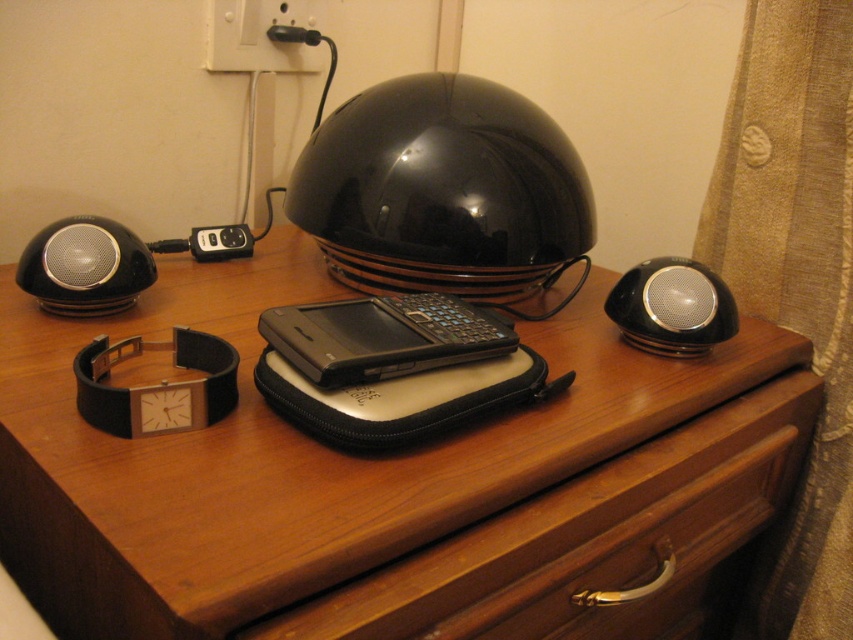
Can you confirm if glossy black helmet at center is shorter than black glossy speaker at left?

No, glossy black helmet at center is not shorter than black glossy speaker at left.

Which is more to the right, glossy black helmet at center or black glossy speaker at left?

glossy black helmet at center is more to the right.

Who is more distant from viewer, (300,189) or (109,291)?

The point (300,189) is behind.

Find the location of a particular element. The width and height of the screenshot is (853, 640). glossy black helmet at center is located at coordinates (444, 189).

Who is positioned more to the left, glossy black helmet at center or black metallic speaker at right?

Positioned to the left is glossy black helmet at center.

What do you see at coordinates (444, 189) in the screenshot? I see `glossy black helmet at center` at bounding box center [444, 189].

Which is in front, point (554, 193) or point (698, 268)?

Point (698, 268) is more forward.

I want to click on glossy black helmet at center, so click(444, 189).

Who is lower down, wooden dresser at center or glossy black helmet at center?

wooden dresser at center

Between wooden dresser at center and glossy black helmet at center, which one appears on the right side from the viewer's perspective?

From the viewer's perspective, glossy black helmet at center appears more on the right side.

The image size is (853, 640). Find the location of `wooden dresser at center`. wooden dresser at center is located at coordinates (386, 483).